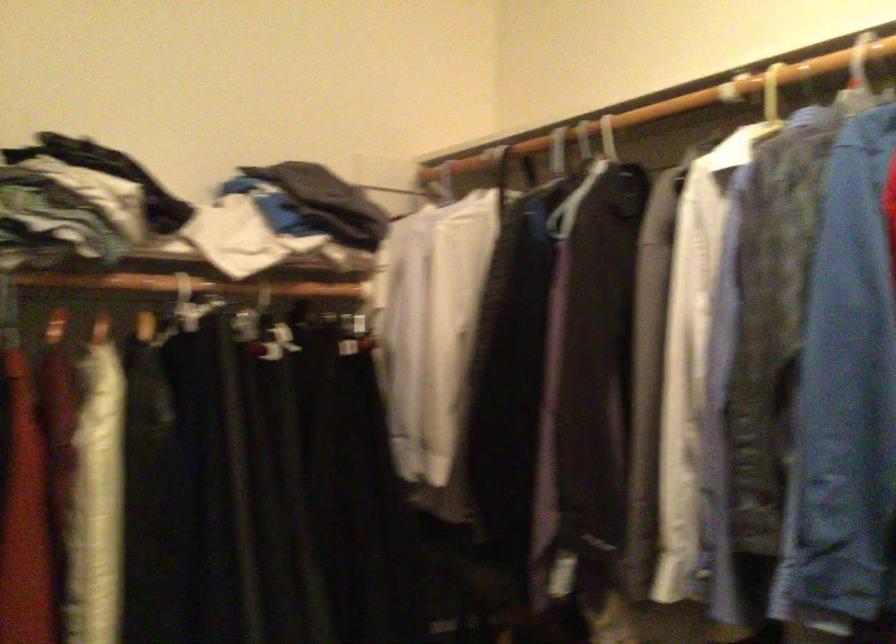
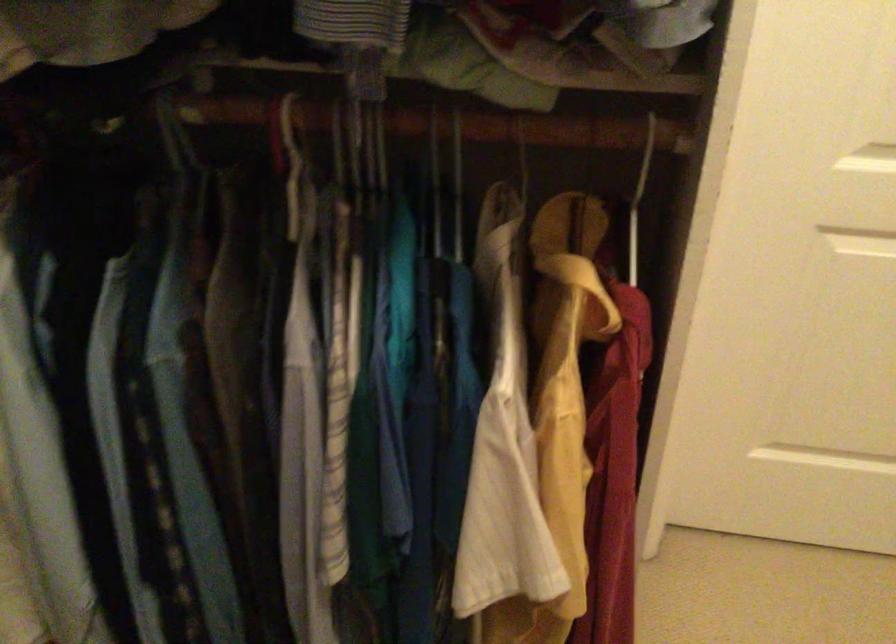
The first image is from the beginning of the video and the second image is from the end. How did the camera likely rotate when shooting the video?

The camera rotated toward right-down.